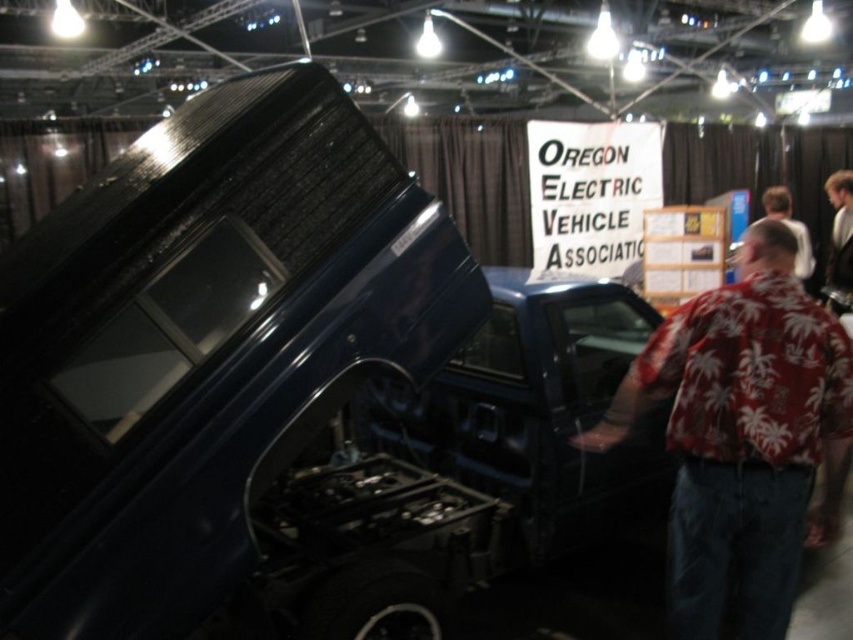
You are attending an event at the Oregon Electric Vehicle Association convention. You notice a person wearing a red palm print shirt at center and a white paper sign at upper center. Which object is larger in size?

The white paper sign at upper center is larger than the red palm print shirt at center.

You are attending an event about electric vehicles and notice two items in the scene. One is a red palm print shirt at center, and the other is a white paper sign at upper center. Which item is narrower?

The red palm print shirt at center is narrower than the white paper sign at upper center.